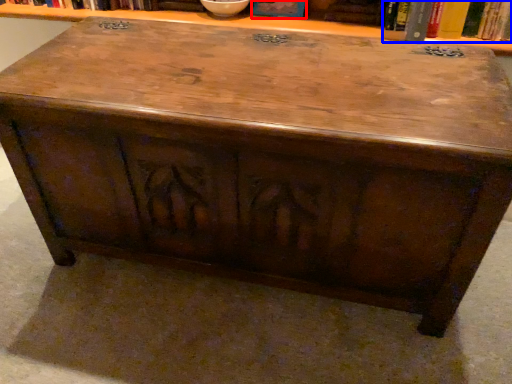
Question: Which object is further to the camera taking this photo, book (highlighted by a red box) or book (highlighted by a blue box)?

Choices:
 (A) book
 (B) book

Answer: (A)